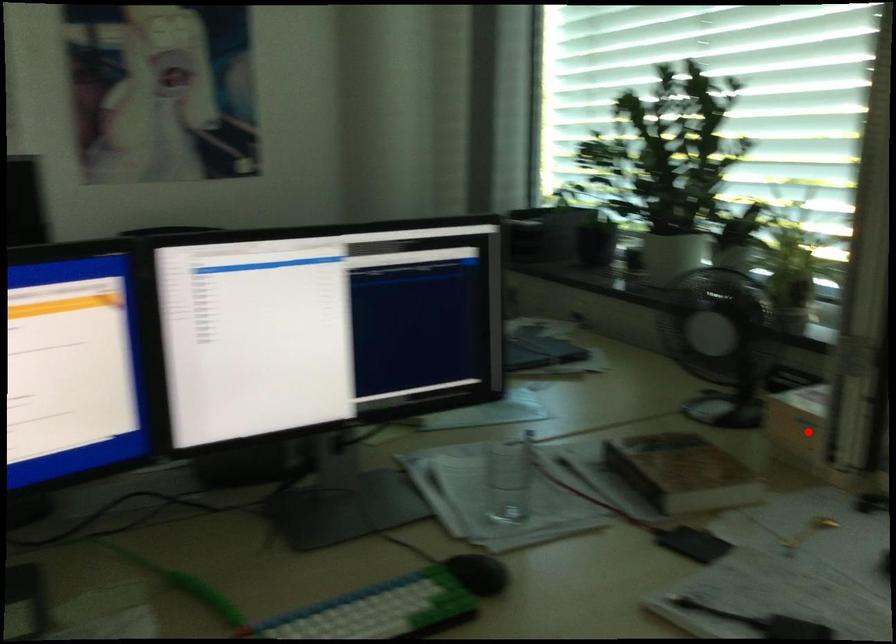
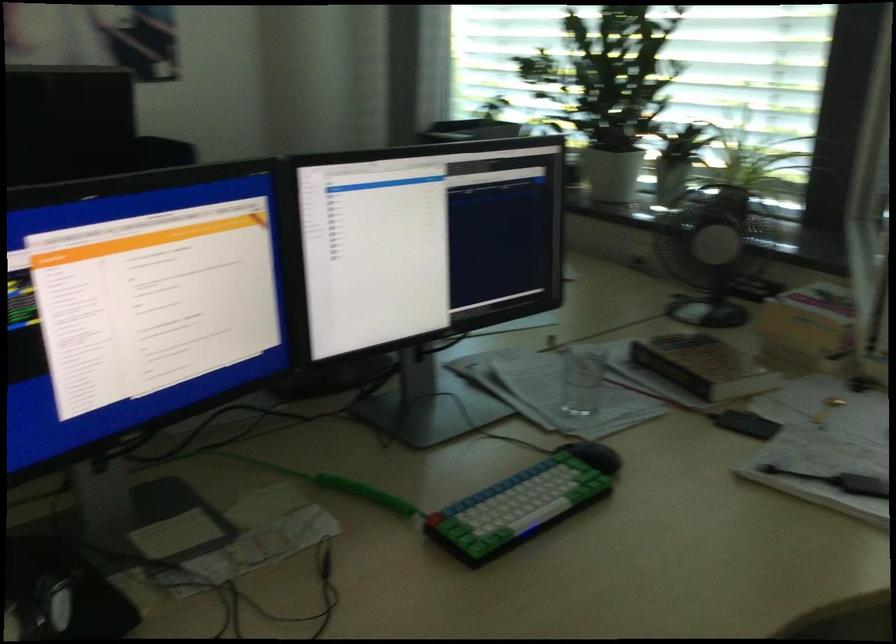
In the second image, find the point that corresponds to the highlighted location in the first image.

(810, 326)